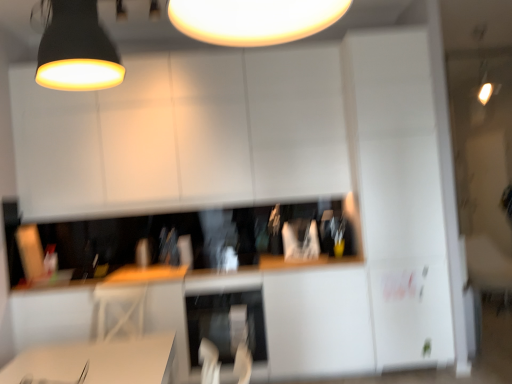
Question: Is matte black lampshade at upper center, the first lamp in the back-to-front sequence, bigger or smaller than matte black lampshade at upper left, which appears as the 2th lamp when viewed from the top?

Choices:
 (A) big
 (B) small

Answer: (A)

Question: In terms of width, does matte black lampshade at upper center, positioned as the 1th lamp in top-to-bottom order, look wider or thinner when compared to matte black lampshade at upper left, which is counted as the 1th lamp, starting from the front?

Choices:
 (A) wide
 (B) thin

Answer: (A)

Question: Estimate the real-world distances between objects in this image. Which object is closer to the satin silver dishwasher at center?

Choices:
 (A) white glossy computer desk at lower center
 (B) matte black lampshade at upper center, positioned as the 1th lamp in top-to-bottom order
 (C) matte black lampshade at upper left, which is counted as the 1th lamp, starting from the front

Answer: (A)

Question: Which is farther from the white glossy computer desk at lower center?

Choices:
 (A) matte black lampshade at upper center, acting as the second lamp starting from the bottom
 (B) matte black lampshade at upper left, the 1th lamp positioned from the left
 (C) satin silver dishwasher at center

Answer: (A)